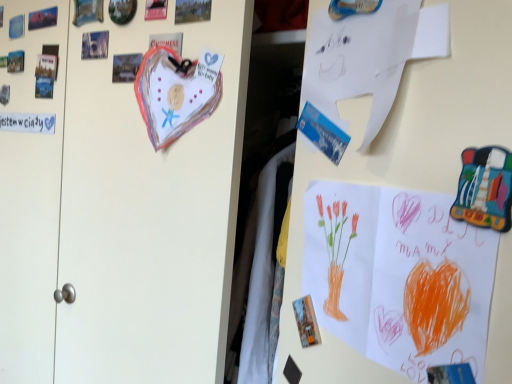
Question: Is orange crayon drawing at lower right completely or partially outside of white paper at upper center?

Choices:
 (A) no
 (B) yes

Answer: (B)

Question: Can you confirm if orange crayon drawing at lower right is positioned to the left of white paper at upper center?

Choices:
 (A) yes
 (B) no

Answer: (B)

Question: From the image's perspective, is orange crayon drawing at lower right located beneath white paper at upper center?

Choices:
 (A) yes
 (B) no

Answer: (A)

Question: Considering the relative sizes of orange crayon drawing at lower right and white paper at upper center in the image provided, is orange crayon drawing at lower right taller than white paper at upper center?

Choices:
 (A) no
 (B) yes

Answer: (B)

Question: Is the depth of orange crayon drawing at lower right less than that of white paper at upper center?

Choices:
 (A) yes
 (B) no

Answer: (A)

Question: Is orange crayon drawing at lower right positioned far away from white paper at upper center?

Choices:
 (A) yes
 (B) no

Answer: (B)

Question: Is white paper at upper center bigger than orange crayon drawing at lower right?

Choices:
 (A) no
 (B) yes

Answer: (B)

Question: From a real-world perspective, is white paper at upper center positioned over orange crayon drawing at lower right based on gravity?

Choices:
 (A) yes
 (B) no

Answer: (A)

Question: Considering the relative sizes of white paper at upper center and orange crayon drawing at lower right in the image provided, is white paper at upper center wider than orange crayon drawing at lower right?

Choices:
 (A) no
 (B) yes

Answer: (B)

Question: Is white paper at upper center completely or partially outside of orange crayon drawing at lower right?

Choices:
 (A) no
 (B) yes

Answer: (B)

Question: Can you confirm if white paper at upper center is positioned to the left of orange crayon drawing at lower right?

Choices:
 (A) yes
 (B) no

Answer: (A)

Question: Is white paper at upper center positioned before orange crayon drawing at lower right?

Choices:
 (A) yes
 (B) no

Answer: (B)

Question: In the image, is white paper at upper center positioned in front of or behind orange crayon drawing at lower right?

Choices:
 (A) front
 (B) behind

Answer: (B)